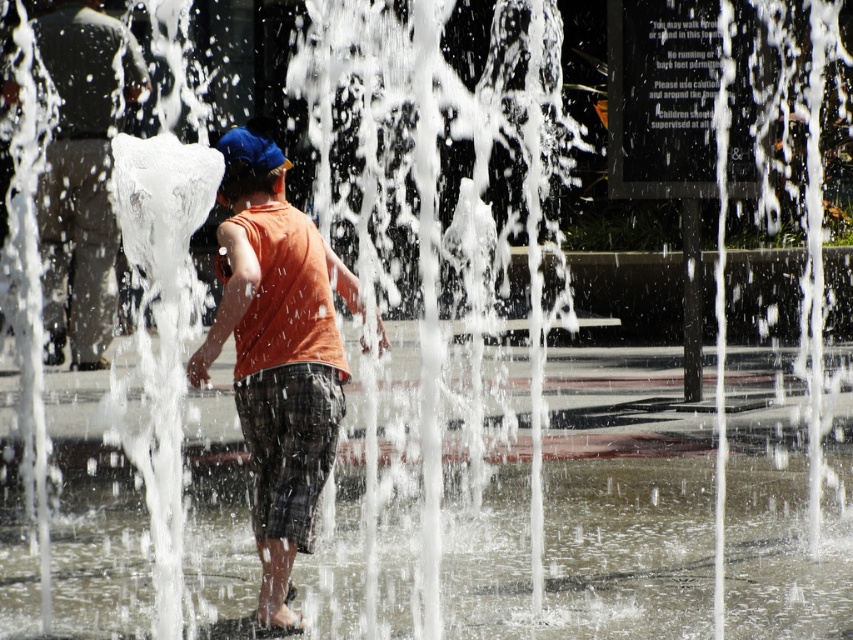
Between point (318, 436) and point (97, 61), which one is positioned behind?

The point (97, 61) is behind.

Is orange cotton tank top at center shorter than orange sleeveless shirt at center?

Yes, orange cotton tank top at center is shorter than orange sleeveless shirt at center.

Who is more forward, [270,163] or [84,17]?

Point [270,163]

I want to click on orange cotton tank top at center, so click(x=277, y=353).